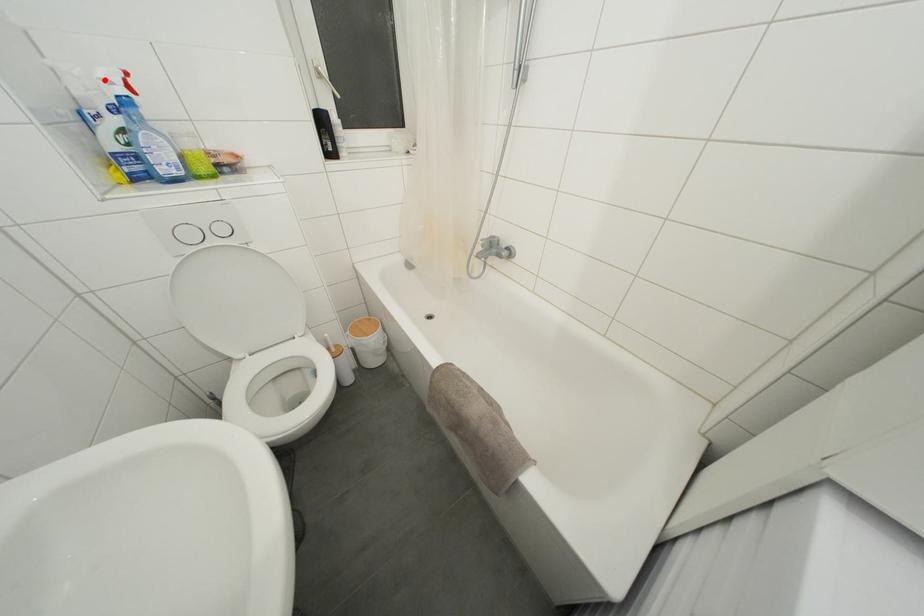
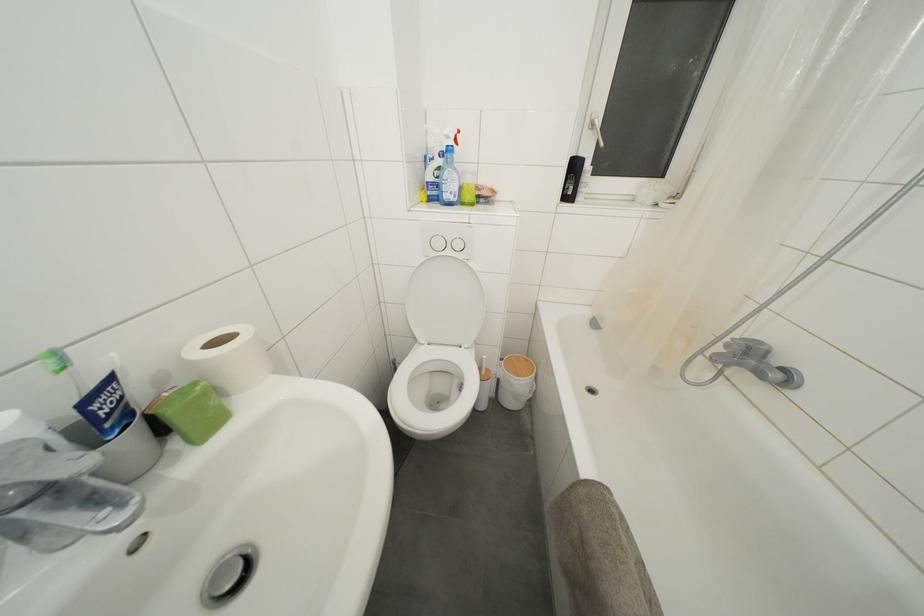
The point at the highlighted location is marked in the first image. Where is the corresponding point in the second image?

(450, 138)